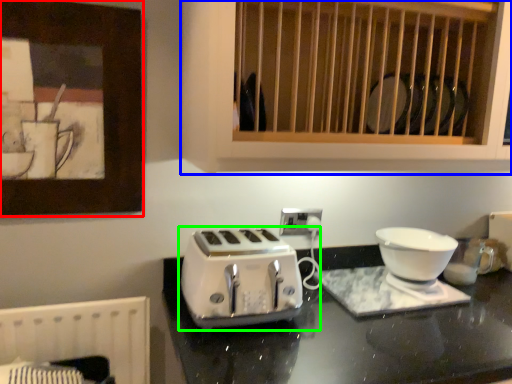
Question: Which object is positioned closest to picture frame (highlighted by a red box)? Select from cabinetry (highlighted by a blue box) and toaster (highlighted by a green box).

Choices:
 (A) cabinetry
 (B) toaster

Answer: (A)